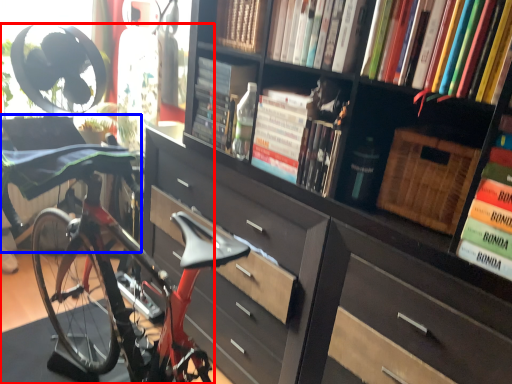
Question: Which object appears closest to the camera in this image, bicycle (highlighted by a red box) or swivel chair (highlighted by a blue box)?

Choices:
 (A) bicycle
 (B) swivel chair

Answer: (B)